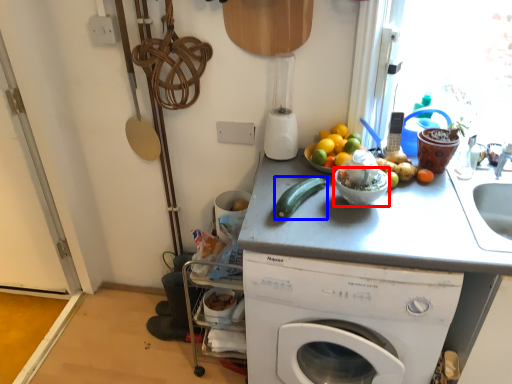
Question: Which object appears closest to the camera in this image, basin (highlighted by a red box) or green vegetables (highlighted by a blue box)?

Choices:
 (A) basin
 (B) green vegetables

Answer: (B)